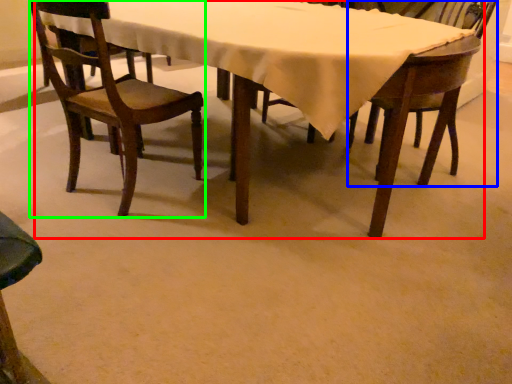
Question: Estimate the real-world distances between objects in this image. Which object is closer to kitchen & dining room table (highlighted by a red box), chair (highlighted by a blue box) or chair (highlighted by a green box)?

Choices:
 (A) chair
 (B) chair

Answer: (B)